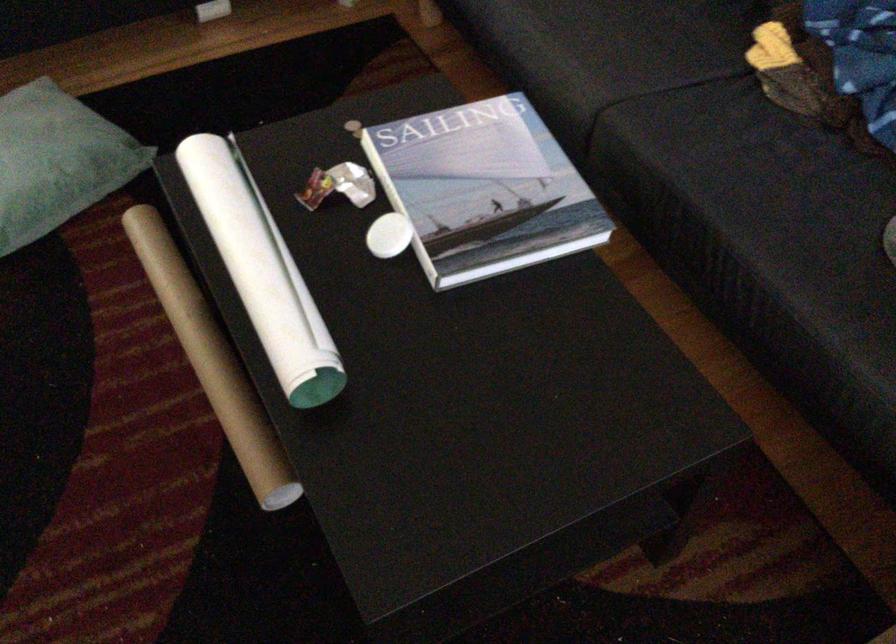
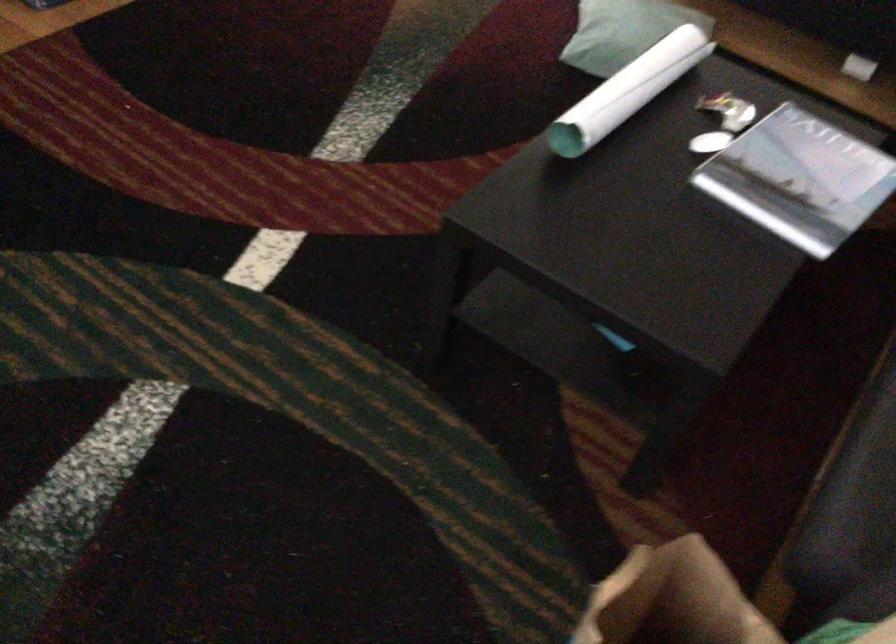
Where in the second image is the point corresponding to (495,190) from the first image?

(798, 178)